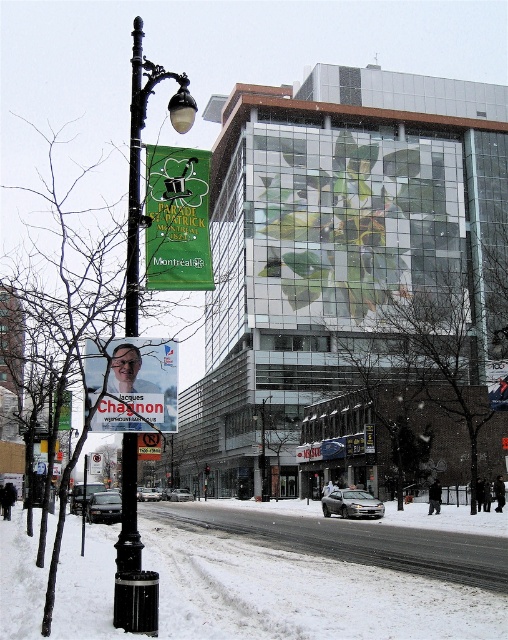
From the picture: Does white snow at lower left appear under matte plastic poster at center?

Correct, white snow at lower left is located below matte plastic poster at center.

Who is positioned more to the right, white snow at lower left or matte plastic poster at center?

matte plastic poster at center

Which is in front, point (81, 592) or point (101, 378)?

Point (101, 378) is in front.

Identify the location of white snow at lower left. (302, 595).

Which is below, green fabric banner at upper left or matte plastic poster at center?

matte plastic poster at center

Does green fabric banner at upper left have a greater width compared to matte plastic poster at center?

Yes.

Does point (205, 262) come closer to viewer compared to point (144, 397)?

No, it is behind (144, 397).

You are a GUI agent. You are given a task and a screenshot of the screen. Output one action in this format:
    pyautogui.click(x=<x>, y=<y>)
    Task: Click on the green fabric banner at upper left
    
    Given the screenshot: What is the action you would take?
    pyautogui.click(x=176, y=220)

Does snowy asphalt road at lower center appear on the right side of matte plastic poster at center?

Incorrect, snowy asphalt road at lower center is not on the right side of matte plastic poster at center.

The height and width of the screenshot is (640, 508). What do you see at coordinates (359, 541) in the screenshot?
I see `snowy asphalt road at lower center` at bounding box center [359, 541].

The image size is (508, 640). I want to click on snowy asphalt road at lower center, so click(x=359, y=541).